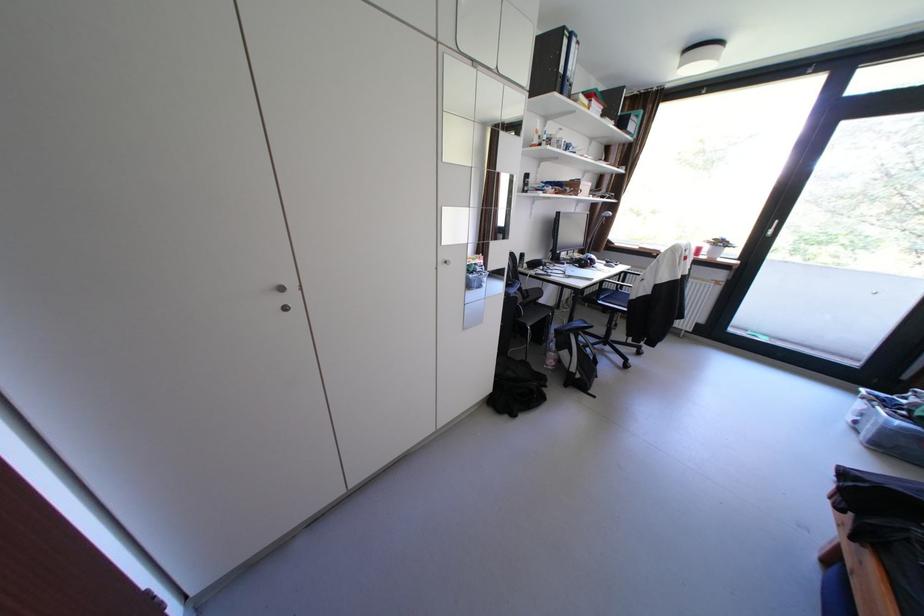
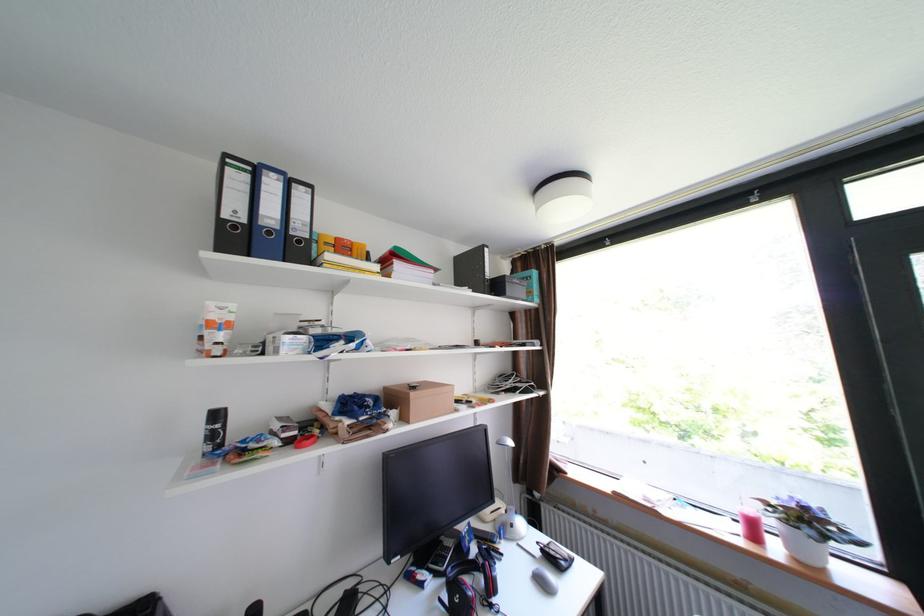
Locate, in the second image, the point that corresponds to [718,248] in the first image.

(782, 523)